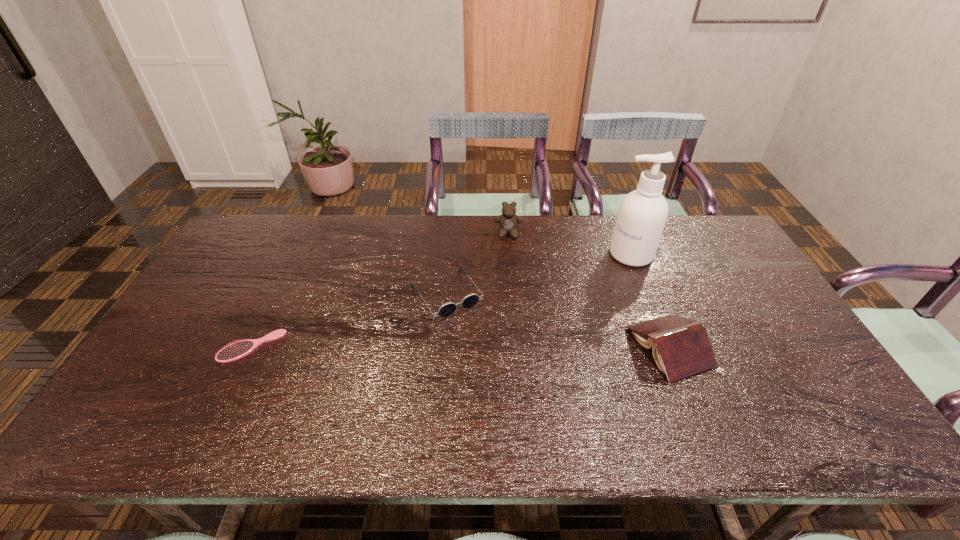
Identify the location of free spot located on the back of the third shortest object. (627, 241).

Locate an element on the screen. This screenshot has height=540, width=960. vacant region located 0.050m on the front-facing side of the second shortest object is located at coordinates (471, 332).

This screenshot has width=960, height=540. Find the location of `free spot located 0.210m on the front-facing side of the second shortest object`. free spot located 0.210m on the front-facing side of the second shortest object is located at coordinates (x=501, y=374).

This screenshot has width=960, height=540. I want to click on free spot located on the front-facing side of the second shortest object, so click(x=499, y=371).

Where is `free space located on the front label of the fourth nearest object`? This screenshot has height=540, width=960. free space located on the front label of the fourth nearest object is located at coordinates (547, 321).

The width and height of the screenshot is (960, 540). I want to click on vacant area situated 0.350m on the front label of the fourth nearest object, so click(x=549, y=319).

Where is `free space located on the front label of the fourth nearest object`? This screenshot has width=960, height=540. free space located on the front label of the fourth nearest object is located at coordinates (580, 295).

What are the coordinates of `vacant area situated 0.390m on the face of the farthest object` in the screenshot? It's located at (511, 325).

Where is `free space located 0.180m on the face of the farthest object`? The height and width of the screenshot is (540, 960). free space located 0.180m on the face of the farthest object is located at coordinates (510, 275).

The width and height of the screenshot is (960, 540). In order to click on free space located 0.300m on the face of the farthest object in this screenshot , I will do `click(511, 302)`.